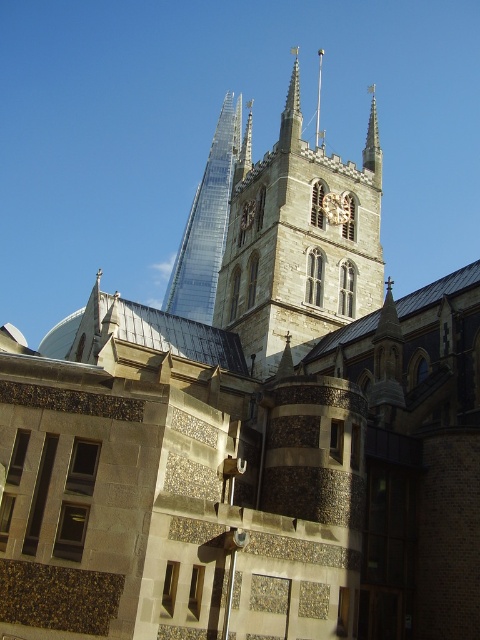
Question: Among these objects, which one is nearest to the camera?

Choices:
 (A) smooth stone spire at center
 (B) transparent glass tower at upper center

Answer: (A)

Question: Can you confirm if stone clock tower at center is smaller than smooth stone spire at upper center?

Choices:
 (A) no
 (B) yes

Answer: (B)

Question: Does transparent glass tower at upper center come behind smooth stone spire at upper center?

Choices:
 (A) no
 (B) yes

Answer: (B)

Question: Is transparent glass tower at upper center positioned at the back of smooth glass spire at upper center?

Choices:
 (A) yes
 (B) no

Answer: (A)

Question: Which of the following is the closest to the observer?

Choices:
 (A) (165, 301)
 (B) (320, 108)
 (C) (256, 179)
 (D) (339, 218)

Answer: (D)

Question: Which is farther from the smooth glass spire at upper center?

Choices:
 (A) smooth stone spire at center
 (B) smooth stone spire at upper center
 (C) transparent glass tower at upper center

Answer: (C)